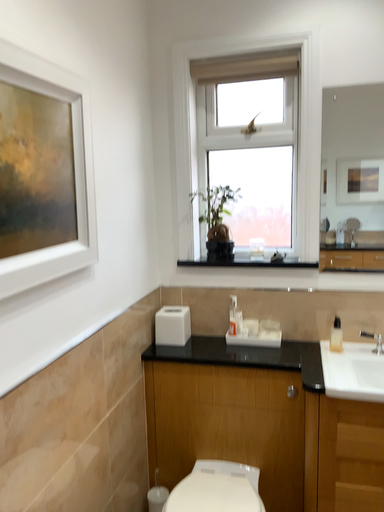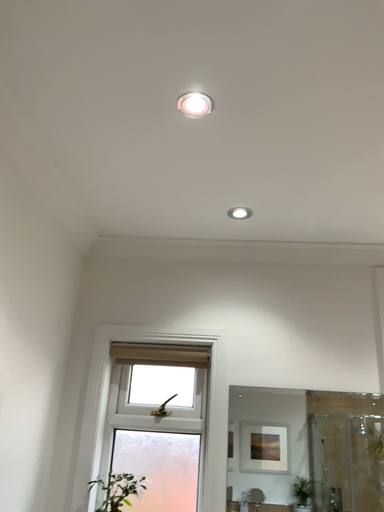
Question: How did the camera likely rotate when shooting the video?

Choices:
 (A) rotated upward
 (B) rotated downward

Answer: (A)